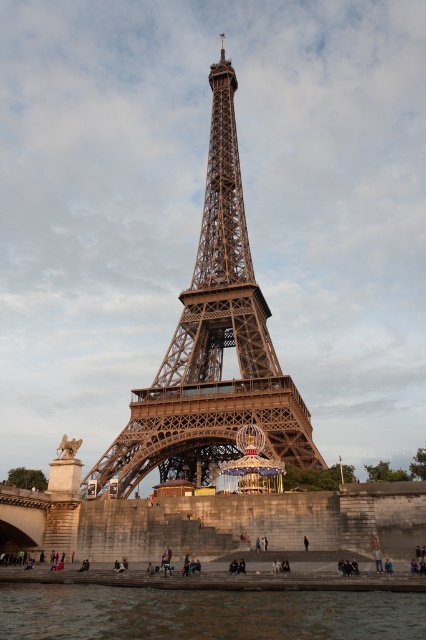
You are standing at the edge of the Seine River and want to take a photo of the brown metal eiffel tower at center and the smooth water at lower center. Which object should you frame first in your camera viewfinder to ensure both are in the shot?

You should frame the smooth water at lower center first because the brown metal eiffel tower at center is to the right of it, so positioning the water first allows you to adjust the camera to include both objects in the frame.